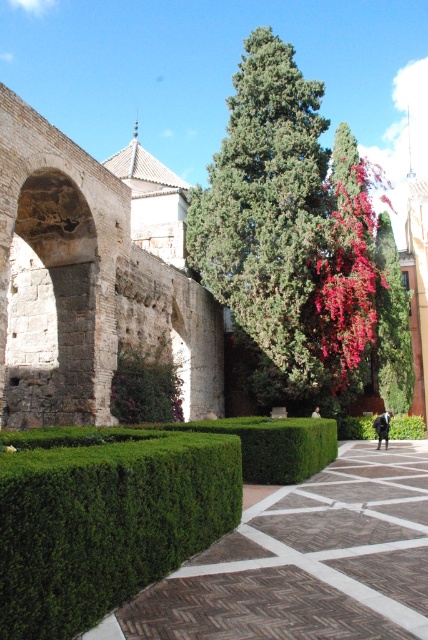
Question: Which point is farther to the camera?

Choices:
 (A) (398, 356)
 (B) (385, 456)

Answer: (A)

Question: Is green leafy hedge at center above green textured tree at center?

Choices:
 (A) no
 (B) yes

Answer: (A)

Question: Which of the following is the farthest from the observer?

Choices:
 (A) green hedge at lower left
 (B) green leafy hedge at center
 (C) green textured tree at center
 (D) green leafy tree at center

Answer: (D)

Question: Is green hedge at lower left below green textured tree at center?

Choices:
 (A) no
 (B) yes

Answer: (B)

Question: Which is nearer to the green leafy tree at center?

Choices:
 (A) green textured tree at center
 (B) green leafy hedge at center

Answer: (A)

Question: Is green textured tree at center to the left of green leafy tree at center from the viewer's perspective?

Choices:
 (A) yes
 (B) no

Answer: (A)